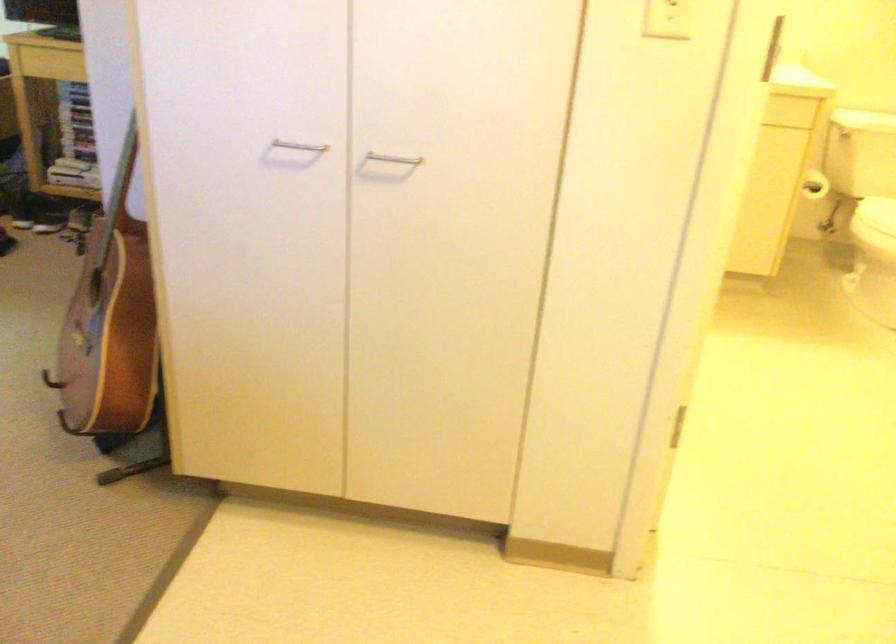
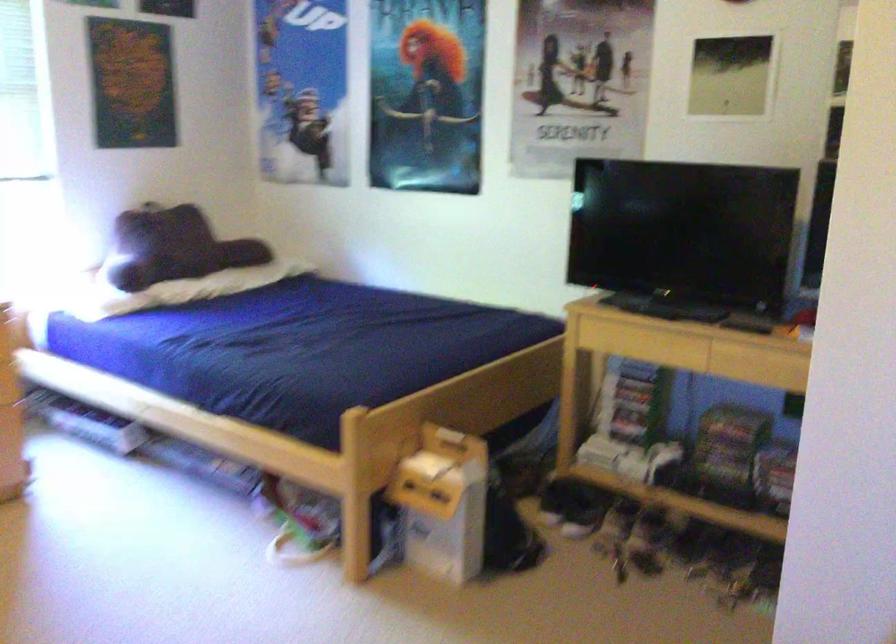
Question: The camera is either moving clockwise (left) or counter-clockwise (right) around the object. The first image is from the beginning of the video and the second image is from the end. Is the camera moving left or right when shooting the video?

Choices:
 (A) Left
 (B) Right

Answer: (B)